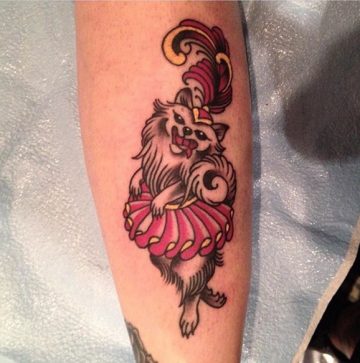
I want to click on dark floor background, so click(x=345, y=336).